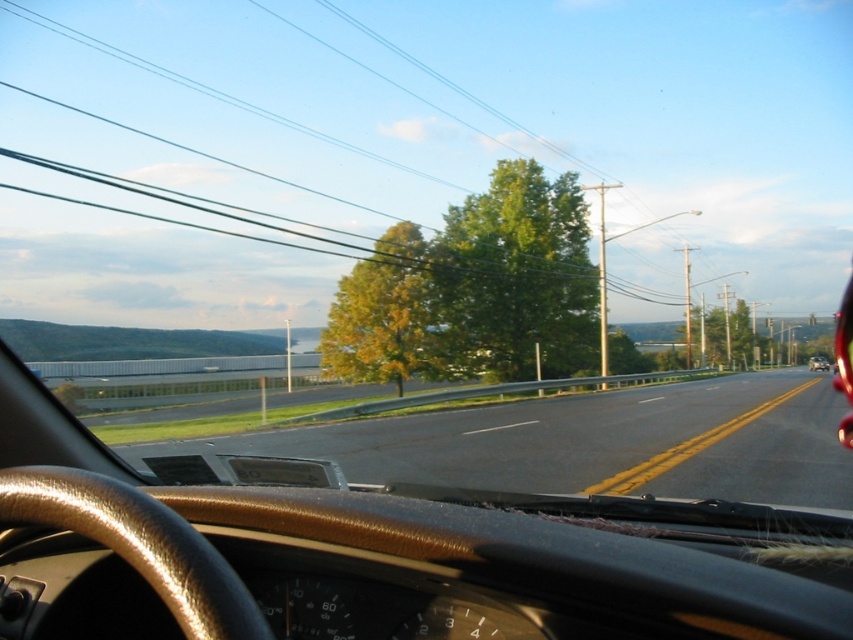
Question: Does green leafy tree at center have a greater width compared to yellow-green leaves at center?

Choices:
 (A) no
 (B) yes

Answer: (B)

Question: Can you confirm if yellow-green leaves at center is positioned above metallic silver suv at right?

Choices:
 (A) yes
 (B) no

Answer: (A)

Question: Which point is farther from the camera taking this photo?

Choices:
 (A) (786, 465)
 (B) (569, 355)
 (C) (814, 362)

Answer: (C)

Question: Among these objects, which one is farthest from the camera?

Choices:
 (A) black asphalt highway at center
 (B) yellow-green leaves at center

Answer: (B)

Question: Which of these objects is positioned closest to the green leafy tree at center?

Choices:
 (A) metallic silver suv at right
 (B) yellow-green leaves at center
 (C) black asphalt highway at center

Answer: (B)

Question: Is green leafy tree at center thinner than yellow-green leaves at center?

Choices:
 (A) no
 (B) yes

Answer: (A)